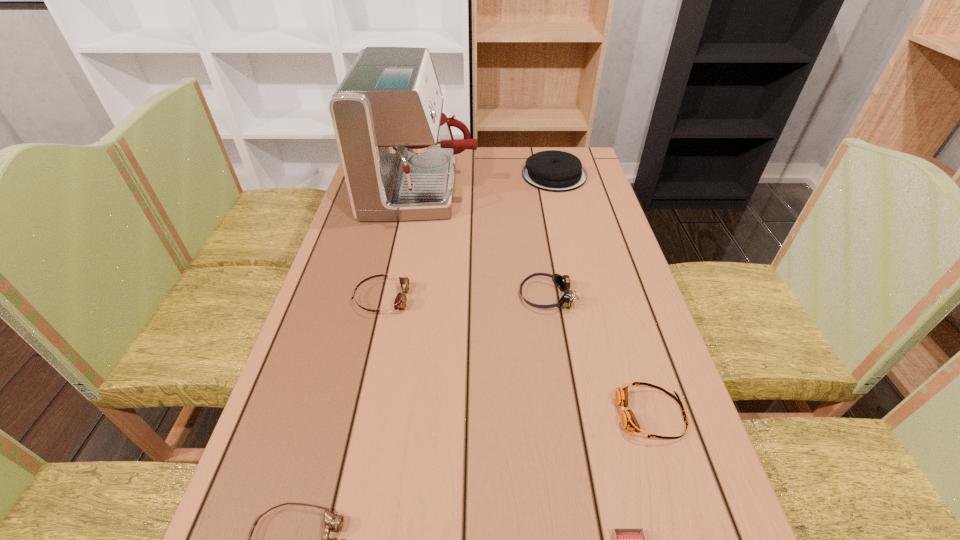
The height and width of the screenshot is (540, 960). Find the location of `vacant space located 0.330m through the lenses of the second goggles from right to left`. vacant space located 0.330m through the lenses of the second goggles from right to left is located at coordinates (386, 296).

The image size is (960, 540). What are the coordinates of `vacant space located 0.280m with the lenses facing forward on the second nearest goggles` in the screenshot? It's located at (473, 414).

Where is `free point located 0.330m with the lenses facing forward on the second nearest goggles`? This screenshot has height=540, width=960. free point located 0.330m with the lenses facing forward on the second nearest goggles is located at coordinates (447, 414).

I want to click on vacant space positioned with the lenses facing forward on the second nearest goggles, so click(499, 414).

Identify the location of coffee maker that is at the far edge. The height and width of the screenshot is (540, 960). (397, 150).

Identify the location of pancake present at the far edge. (555, 171).

Image resolution: width=960 pixels, height=540 pixels. Find the location of `coffee maker present at the left edge`. coffee maker present at the left edge is located at coordinates (397, 150).

In order to click on goggles that is at the left edge in this screenshot , I will do `click(400, 301)`.

Locate an element on the screen. The width and height of the screenshot is (960, 540). pancake located in the right edge section of the desktop is located at coordinates (555, 171).

Find the location of a particular element. This screenshot has width=960, height=540. goggles situated at the right edge is located at coordinates (628, 421).